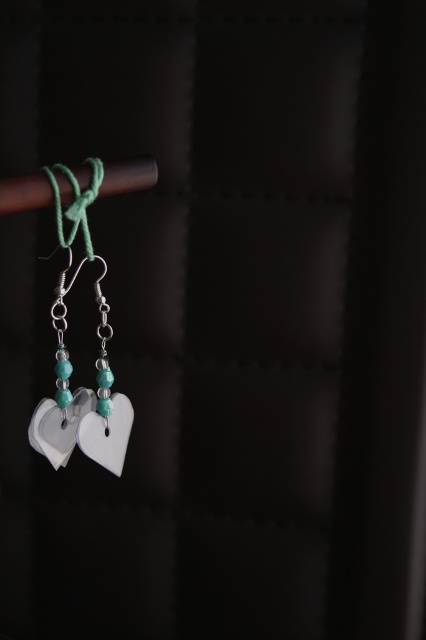
Question: Can you confirm if white plastic heart-shaped pendants at left is positioned to the right of green thread at upper left?

Choices:
 (A) no
 (B) yes

Answer: (B)

Question: Which point is closer to the camera?

Choices:
 (A) (101, 362)
 (B) (55, 225)

Answer: (B)

Question: Is white plastic heart-shaped pendants at left bigger than green thread at upper left?

Choices:
 (A) yes
 (B) no

Answer: (A)

Question: Does white plastic heart-shaped pendants at left come behind green thread at upper left?

Choices:
 (A) no
 (B) yes

Answer: (B)